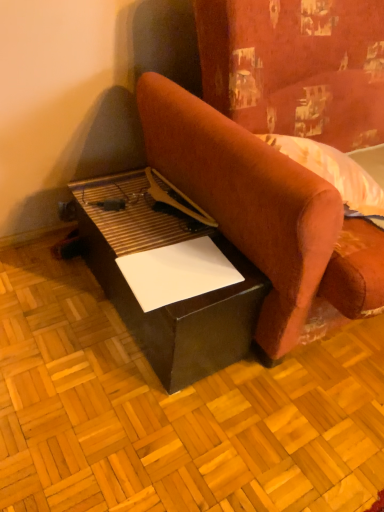
Question: Is black leather table at lower left next to white paper at lower center and touching it?

Choices:
 (A) no
 (B) yes

Answer: (A)

Question: Is black leather table at lower left bigger than white paper at lower center?

Choices:
 (A) no
 (B) yes

Answer: (B)

Question: Is black leather table at lower left wider than white paper at lower center?

Choices:
 (A) yes
 (B) no

Answer: (A)

Question: From the image's perspective, is black leather table at lower left under white paper at lower center?

Choices:
 (A) no
 (B) yes

Answer: (A)

Question: From the image's perspective, does black leather table at lower left appear higher than white paper at lower center?

Choices:
 (A) no
 (B) yes

Answer: (B)

Question: Looking at their shapes, would you say black leather table at lower left is wider or thinner than white paper at lower center?

Choices:
 (A) thin
 (B) wide

Answer: (B)

Question: In terms of height, does black leather table at lower left look taller or shorter compared to white paper at lower center?

Choices:
 (A) short
 (B) tall

Answer: (B)

Question: From a real-world perspective, relative to white paper at lower center, is black leather table at lower left vertically above or below?

Choices:
 (A) below
 (B) above

Answer: (A)

Question: Is point (147, 349) positioned closer to the camera than point (198, 292)?

Choices:
 (A) farther
 (B) closer

Answer: (A)

Question: From the image's perspective, relative to velvet-like red couch at center, is white paper at lower center above or below?

Choices:
 (A) above
 (B) below

Answer: (B)

Question: From a real-world perspective, relative to velvet-like red couch at center, is white paper at lower center vertically above or below?

Choices:
 (A) above
 (B) below

Answer: (B)

Question: Based on their sizes in the image, would you say white paper at lower center is bigger or smaller than velvet-like red couch at center?

Choices:
 (A) small
 (B) big

Answer: (A)

Question: Would you say white paper at lower center is inside or outside velvet-like red couch at center?

Choices:
 (A) inside
 (B) outside

Answer: (B)

Question: Considering the positions of point (190, 101) and point (180, 289), is point (190, 101) closer or farther from the camera than point (180, 289)?

Choices:
 (A) closer
 (B) farther

Answer: (B)

Question: Is velvet-like red couch at center to the left or to the right of white paper at lower center in the image?

Choices:
 (A) right
 (B) left

Answer: (A)